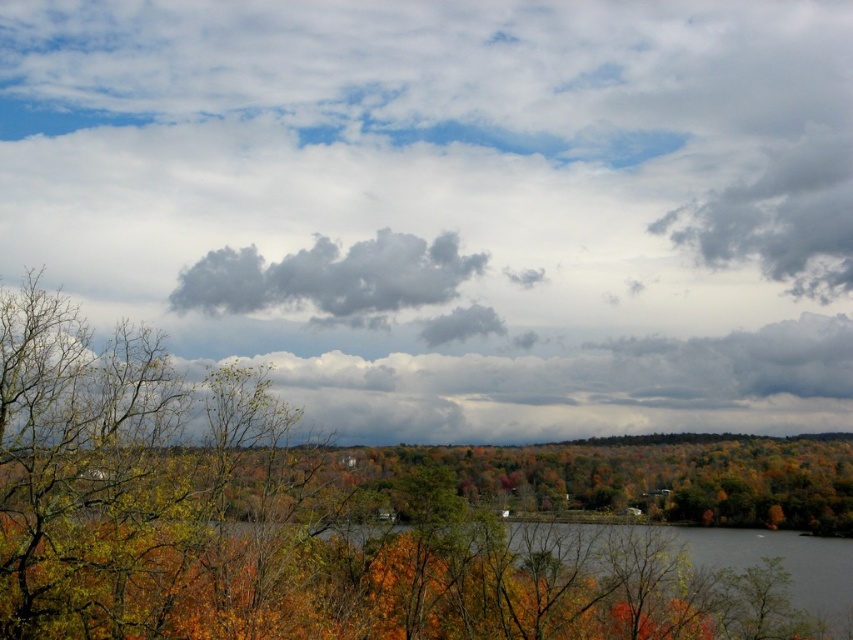
Does green matte tree at center come behind dark gray fluffy cloud at center?

No, it is in front of dark gray fluffy cloud at center.

Is green matte tree at center to the left of dark gray fluffy cloud at center from the viewer's perspective?

No, green matte tree at center is not to the left of dark gray fluffy cloud at center.

Is point (91, 387) positioned after point (334, 253)?

No, it is not.

Locate an element on the screen. The width and height of the screenshot is (853, 640). green matte tree at center is located at coordinates (277, 522).

Is cloudy sky at upper center bigger than green matte tree at center?

Yes, cloudy sky at upper center is bigger than green matte tree at center.

Which is below, cloudy sky at upper center or green matte tree at center?

green matte tree at center

Where is `cloudy sky at upper center`? cloudy sky at upper center is located at coordinates tap(453, 204).

Image resolution: width=853 pixels, height=640 pixels. I want to click on cloudy sky at upper center, so click(453, 204).

Where is `cloudy sky at upper center`? cloudy sky at upper center is located at coordinates (453, 204).